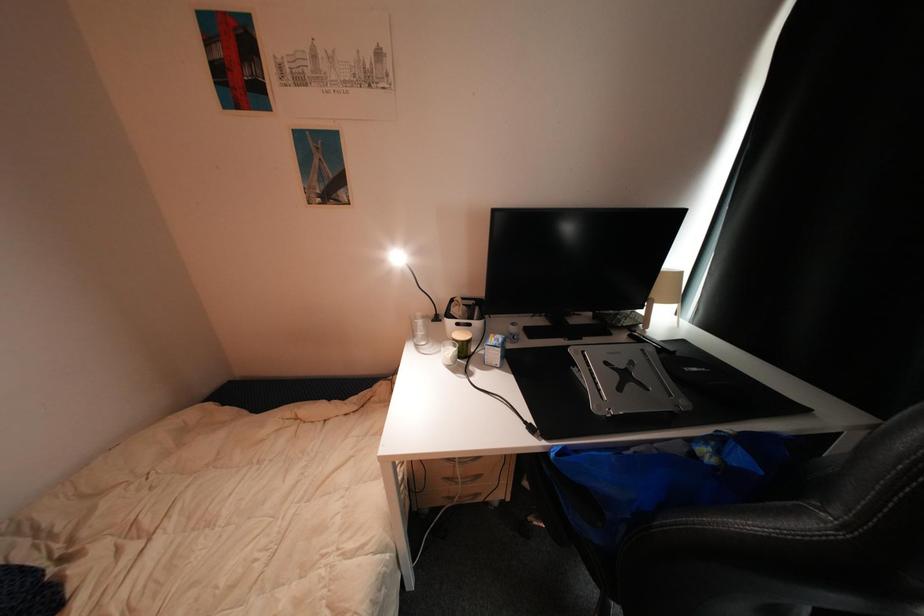
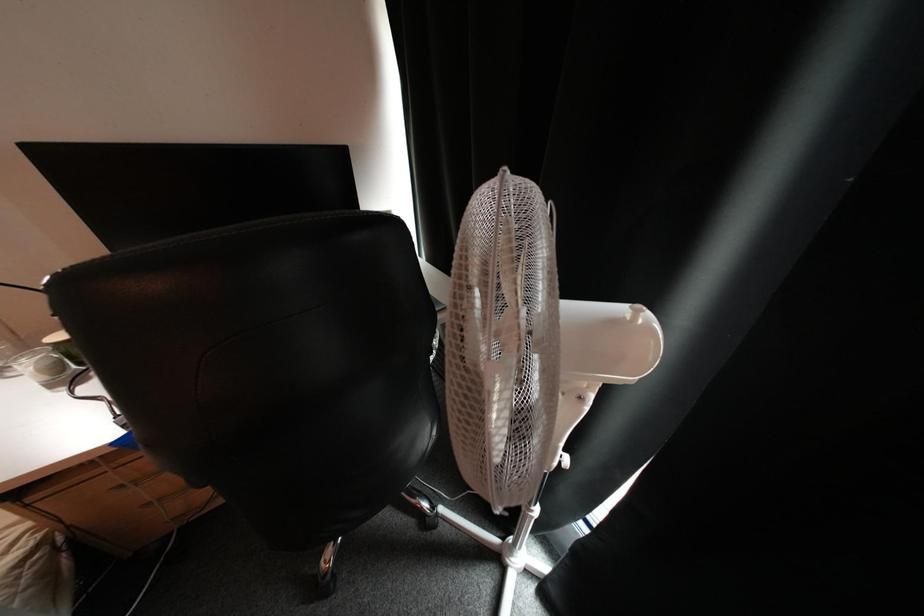
Question: How did the camera likely rotate?

Choices:
 (A) Left
 (B) Right
 (C) Up
 (D) Down

Answer: (B)